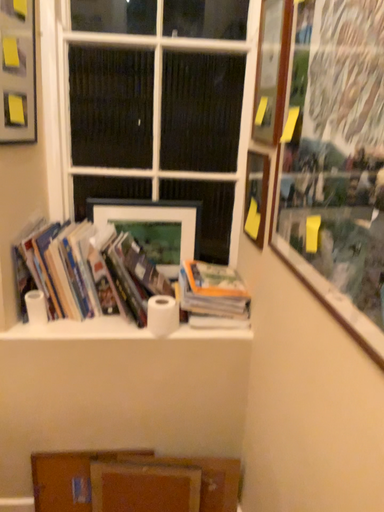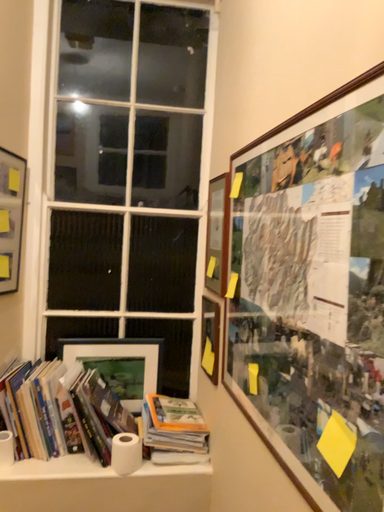
Question: Which way did the camera rotate in the video?

Choices:
 (A) rotated downward
 (B) rotated upward

Answer: (B)